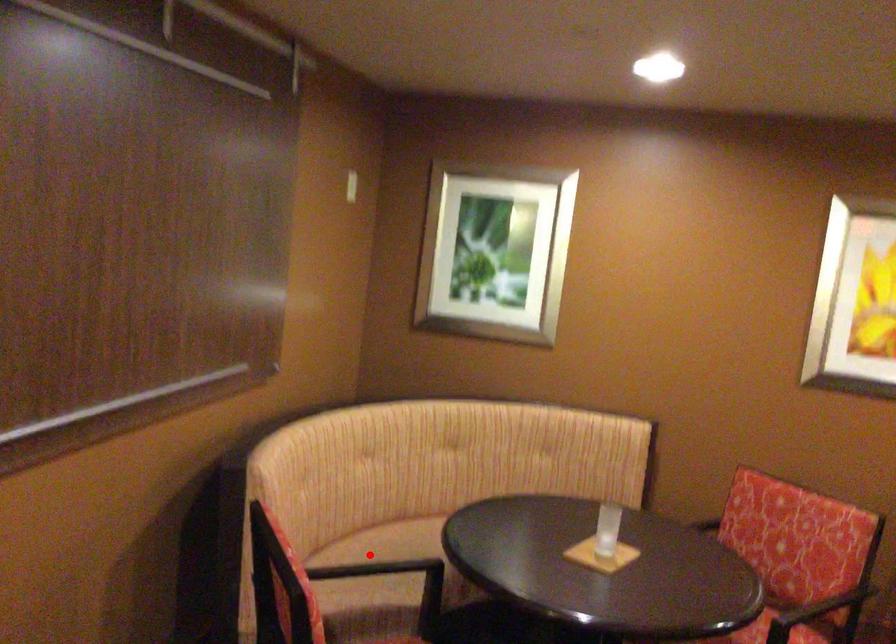
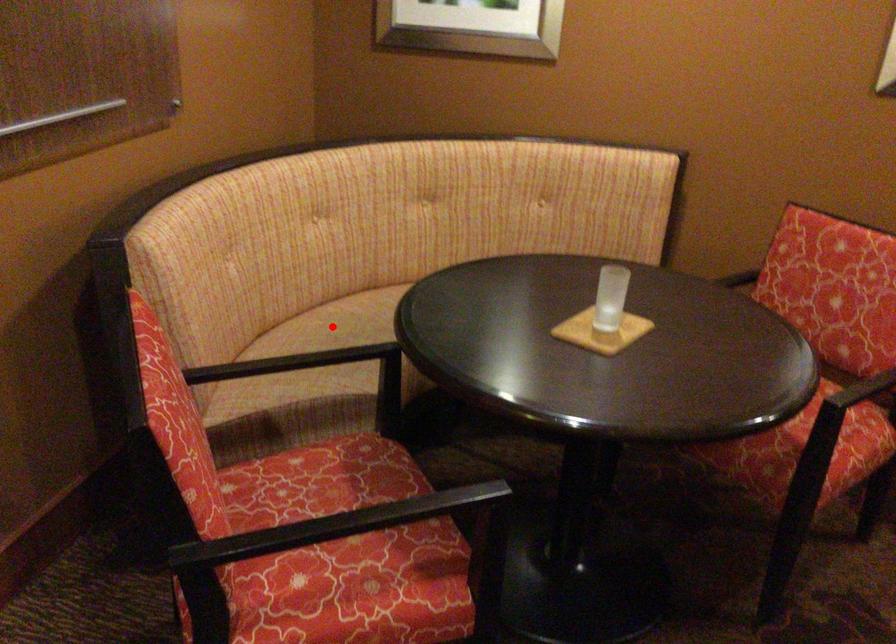
I am providing you with two images of the same scene from different viewpoints. A red point is marked on the first image and another point is marked on the second image. Do the highlighted points in image1 and image2 indicate the same real-world spot?

Yes